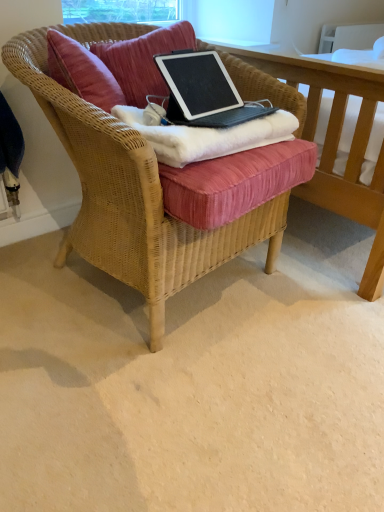
Question: Does black matte laptop at center appear on the right side of velvet cushion at center?

Choices:
 (A) no
 (B) yes

Answer: (B)

Question: Would you say black matte laptop at center is a long distance from velvet cushion at center?

Choices:
 (A) yes
 (B) no

Answer: (B)

Question: Is black matte laptop at center positioned beyond the bounds of velvet cushion at center?

Choices:
 (A) no
 (B) yes

Answer: (B)

Question: Considering the relative sizes of black matte laptop at center and velvet cushion at center in the image provided, is black matte laptop at center taller than velvet cushion at center?

Choices:
 (A) yes
 (B) no

Answer: (B)

Question: From the image's perspective, is black matte laptop at center on top of velvet cushion at center?

Choices:
 (A) no
 (B) yes

Answer: (A)

Question: Is point (153, 322) closer or farther from the camera than point (127, 74)?

Choices:
 (A) farther
 (B) closer

Answer: (B)

Question: From the image's perspective, is woven wicker chair at center positioned above or below velvet cushion at center?

Choices:
 (A) below
 (B) above

Answer: (A)

Question: In terms of size, does woven wicker chair at center appear bigger or smaller than velvet cushion at center?

Choices:
 (A) small
 (B) big

Answer: (B)

Question: Is woven wicker chair at center taller or shorter than velvet cushion at center?

Choices:
 (A) short
 (B) tall

Answer: (B)

Question: In terms of width, does black matte laptop at center look wider or thinner when compared to velvet cushion at center?

Choices:
 (A) wide
 (B) thin

Answer: (B)

Question: Considering the positions of black matte laptop at center and velvet cushion at center in the image, is black matte laptop at center bigger or smaller than velvet cushion at center?

Choices:
 (A) big
 (B) small

Answer: (B)

Question: Considering the positions of black matte laptop at center and velvet cushion at center in the image, is black matte laptop at center taller or shorter than velvet cushion at center?

Choices:
 (A) tall
 (B) short

Answer: (B)

Question: Based on their positions, is black matte laptop at center located to the left or right of velvet cushion at center?

Choices:
 (A) right
 (B) left

Answer: (A)

Question: Is white fluffy blanket at center to the left or to the right of velvet cushion at center in the image?

Choices:
 (A) right
 (B) left

Answer: (A)

Question: In terms of height, does white fluffy blanket at center look taller or shorter compared to velvet cushion at center?

Choices:
 (A) short
 (B) tall

Answer: (A)